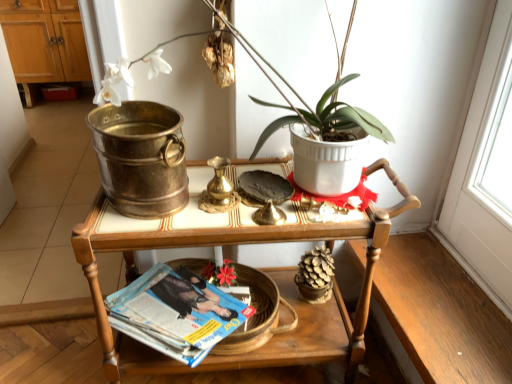
Question: Is white ceramic pot at upper center facing towards wooden tray at center?

Choices:
 (A) no
 (B) yes

Answer: (A)

Question: Would you say white ceramic pot at upper center contains wooden tray at center?

Choices:
 (A) yes
 (B) no

Answer: (B)

Question: From a real-world perspective, is white ceramic pot at upper center over wooden tray at center?

Choices:
 (A) yes
 (B) no

Answer: (A)

Question: Is white ceramic pot at upper center taller than wooden tray at center?

Choices:
 (A) yes
 (B) no

Answer: (B)

Question: Considering the relative sizes of white ceramic pot at upper center and wooden tray at center in the image provided, is white ceramic pot at upper center smaller than wooden tray at center?

Choices:
 (A) no
 (B) yes

Answer: (B)

Question: Is white ceramic pot at upper center inside the boundaries of wooden tray at center, or outside?

Choices:
 (A) inside
 (B) outside

Answer: (B)

Question: From the image's perspective, is white ceramic pot at upper center located above or below wooden tray at center?

Choices:
 (A) above
 (B) below

Answer: (A)

Question: Is white ceramic pot at upper center in front of or behind wooden tray at center in the image?

Choices:
 (A) behind
 (B) front

Answer: (B)

Question: Would you say white ceramic pot at upper center is to the left or to the right of wooden tray at center in the picture?

Choices:
 (A) left
 (B) right

Answer: (B)

Question: In terms of height, does blue glossy magazine at lower center look taller or shorter compared to white ceramic pot at upper center?

Choices:
 (A) tall
 (B) short

Answer: (B)

Question: Is point (118, 299) closer or farther from the camera than point (181, 61)?

Choices:
 (A) closer
 (B) farther

Answer: (B)

Question: From a real-world perspective, relative to white ceramic pot at upper center, is blue glossy magazine at lower center vertically above or below?

Choices:
 (A) below
 (B) above

Answer: (A)

Question: Considering the positions of blue glossy magazine at lower center and white ceramic pot at upper center in the image, is blue glossy magazine at lower center wider or thinner than white ceramic pot at upper center?

Choices:
 (A) wide
 (B) thin

Answer: (A)

Question: From their relative heights in the image, would you say brushed metal bucket at upper left is taller or shorter than white ceramic pot at upper center?

Choices:
 (A) tall
 (B) short

Answer: (A)

Question: Considering the positions of point (62, 13) and point (376, 122), is point (62, 13) closer or farther from the camera than point (376, 122)?

Choices:
 (A) farther
 (B) closer

Answer: (A)